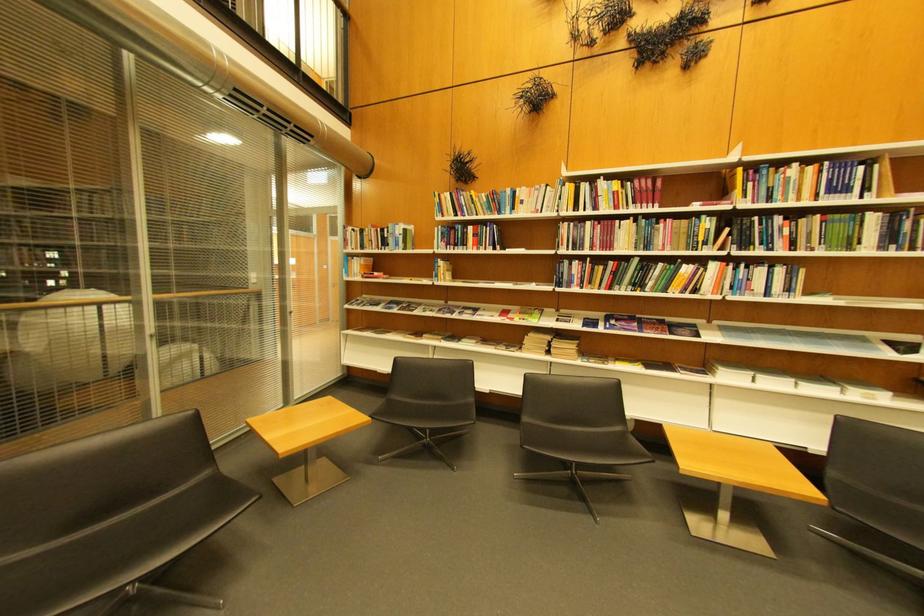
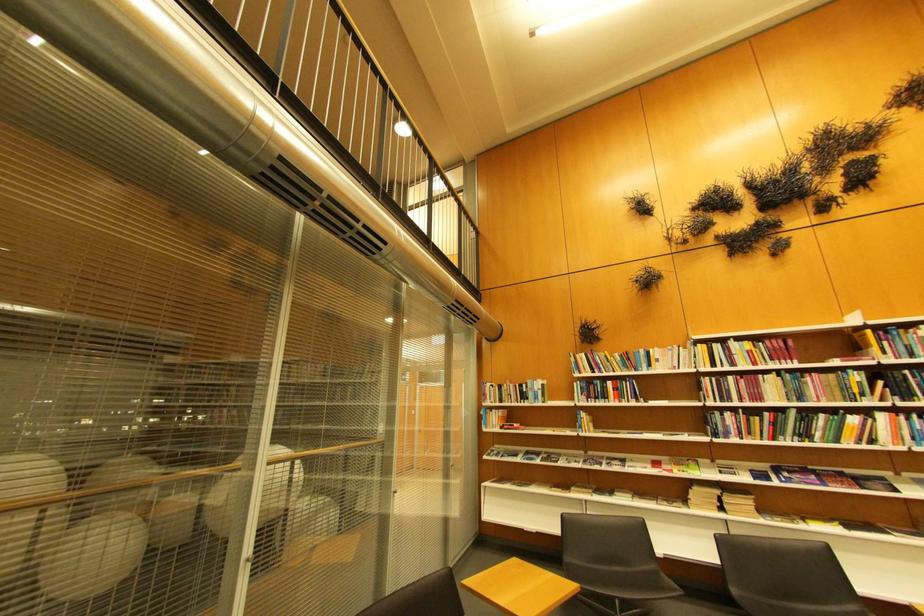
In the second image, find the point that corresponds to (x=454, y=246) in the first image.

(594, 399)